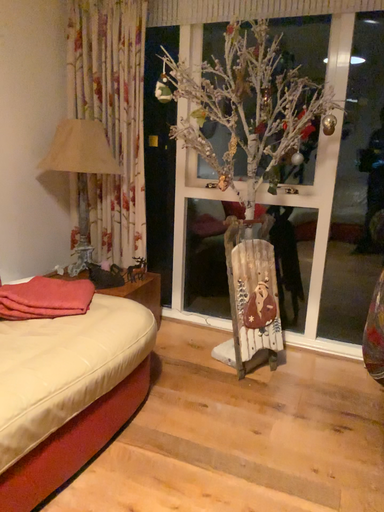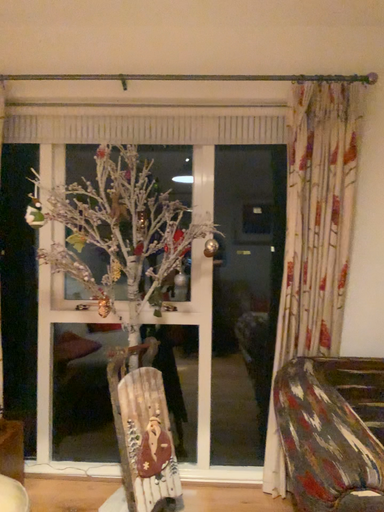
Question: Which way did the camera rotate in the video?

Choices:
 (A) rotated left
 (B) rotated right

Answer: (B)